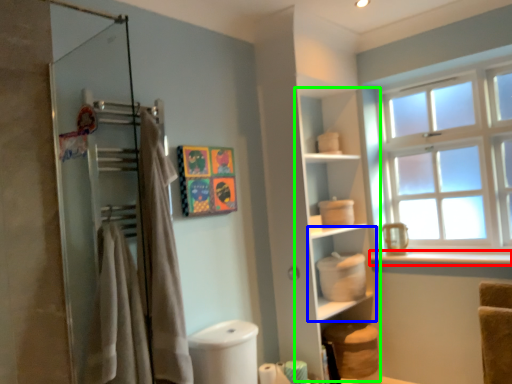
Question: Considering the real-world distances, which object is closest to window sill (highlighted by a red box)? shelf (highlighted by a blue box) or cabinet (highlighted by a green box).

Choices:
 (A) shelf
 (B) cabinet

Answer: (A)